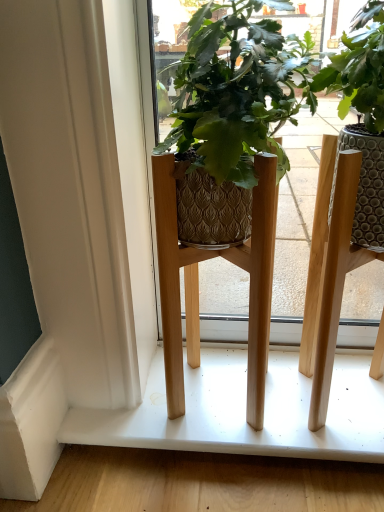
Where is `empty space that is ontop of white matte shelf at lower center (from a real-world perspective)`? This screenshot has height=512, width=384. empty space that is ontop of white matte shelf at lower center (from a real-world perspective) is located at coordinates coord(240,400).